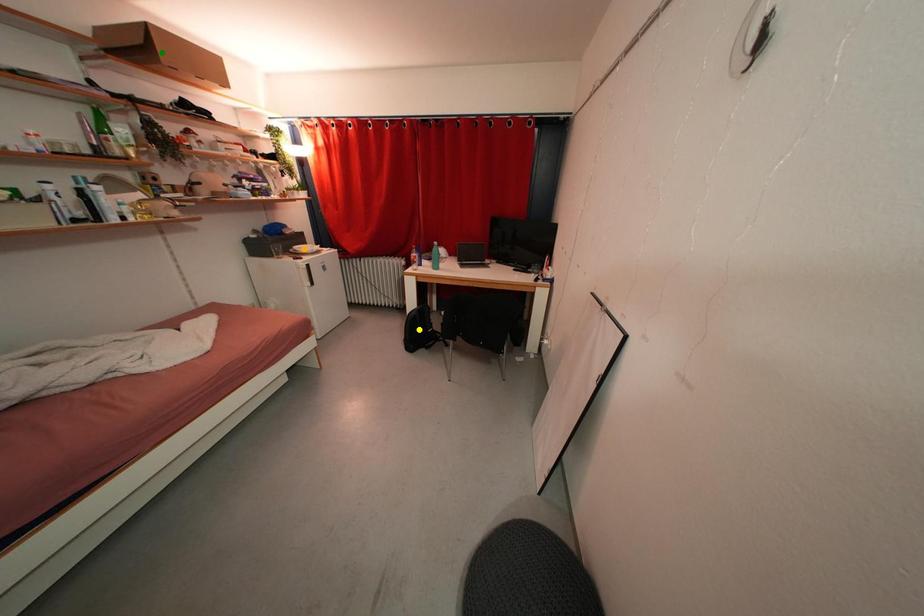
Consider the image. Order these from farthest to nearest:
orange point, green point, yellow point

orange point
yellow point
green point